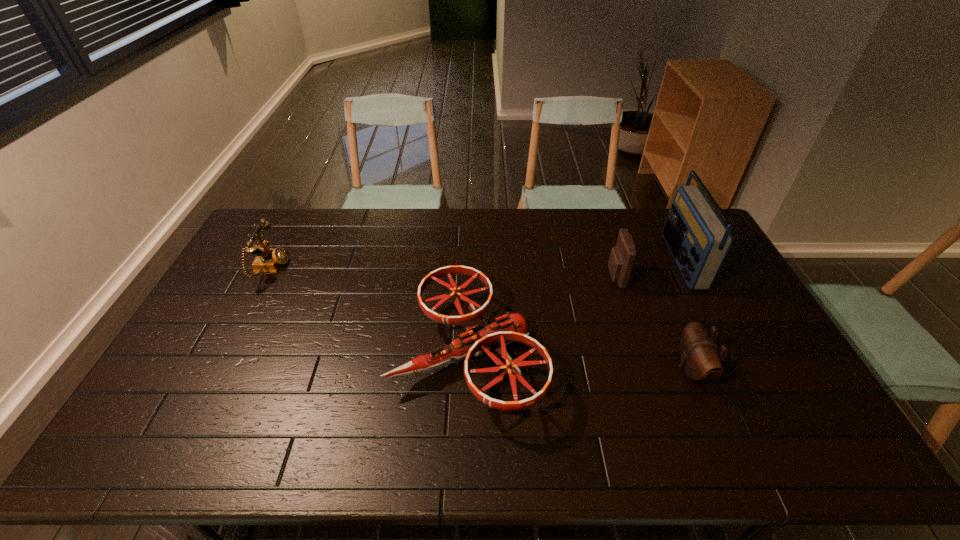
Find the location of a particular element. vacant space located on the front panel of the radio receiver is located at coordinates (561, 261).

Identify the location of free location located 0.080m with an open flap on the farther pouch. The width and height of the screenshot is (960, 540). pyautogui.click(x=584, y=276).

Identify the location of vacant space located 0.370m with an open flap on the farther pouch. (497, 276).

The width and height of the screenshot is (960, 540). I want to click on vacant space located 0.160m with an open flap on the farther pouch, so click(560, 276).

Locate an element on the screen. The image size is (960, 540). vacant area located on the dial number of the telephone is located at coordinates (342, 269).

Locate an element on the screen. This screenshot has height=540, width=960. vacant position located with the flap open on the right pouch is located at coordinates (539, 369).

This screenshot has width=960, height=540. What are the coordinates of `vacant space located 0.360m with the flap open on the right pouch` in the screenshot? It's located at (546, 369).

Locate an element on the screen. Image resolution: width=960 pixels, height=540 pixels. vacant region located with the flap open on the right pouch is located at coordinates (550, 369).

This screenshot has width=960, height=540. Identify the location of blank space located 0.140m on the back of the drone. (470, 264).

Identify the location of object that is at the far edge. (699, 241).